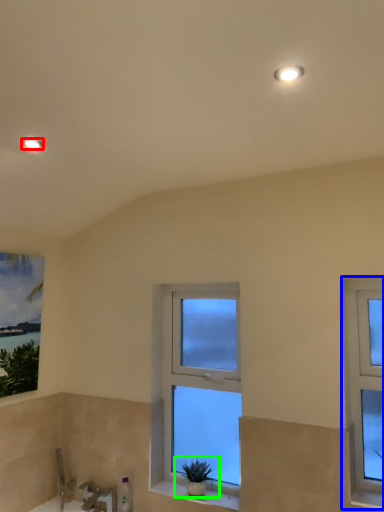
Question: Based on their relative distances, which object is nearer to light fixture (highlighted by a red box)? Choose from window (highlighted by a blue box) and houseplant (highlighted by a green box).

Choices:
 (A) window
 (B) houseplant

Answer: (A)